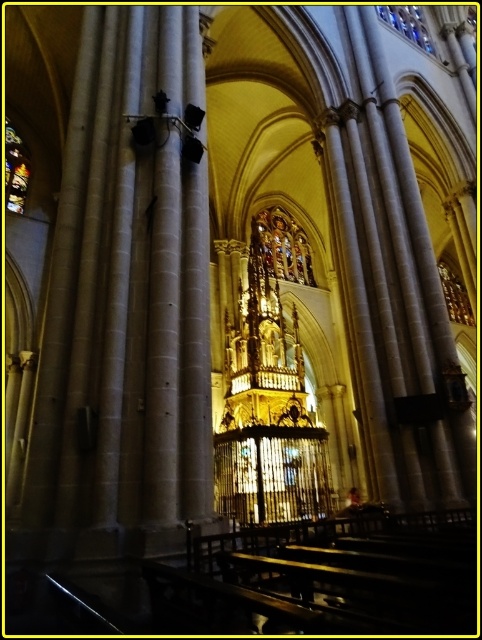
Question: Observing the image, what is the correct spatial positioning of stained glass window at upper left in reference to stained glass window at upper center?

Choices:
 (A) below
 (B) above

Answer: (A)

Question: Does stained glass window at upper left appear under stained glass window at upper center?

Choices:
 (A) no
 (B) yes

Answer: (B)

Question: Which point is closer to the camera?

Choices:
 (A) stained glass window at upper left
 (B) stained glass window at upper center

Answer: (A)

Question: Which of the following is the closest to the observer?

Choices:
 (A) stained glass window at upper center
 (B) stained glass window at upper left

Answer: (B)

Question: Can you confirm if stained glass window at upper left is bigger than stained glass window at upper center?

Choices:
 (A) yes
 (B) no

Answer: (B)